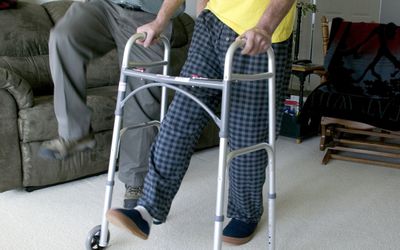
This screenshot has height=250, width=400. Find the location of `chair`. chair is located at coordinates (339, 120).